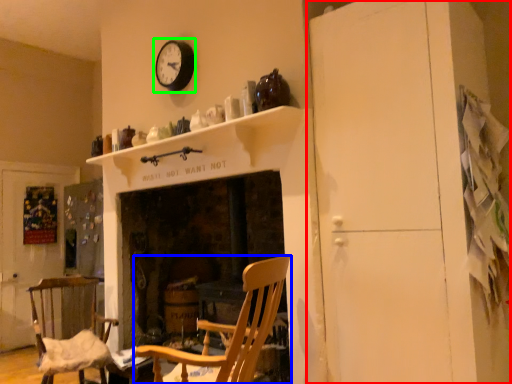
Question: Which object is positioned closest to dresser (highlighted by a red box)? Select from chair (highlighted by a blue box) and clock (highlighted by a green box).

Choices:
 (A) chair
 (B) clock

Answer: (A)